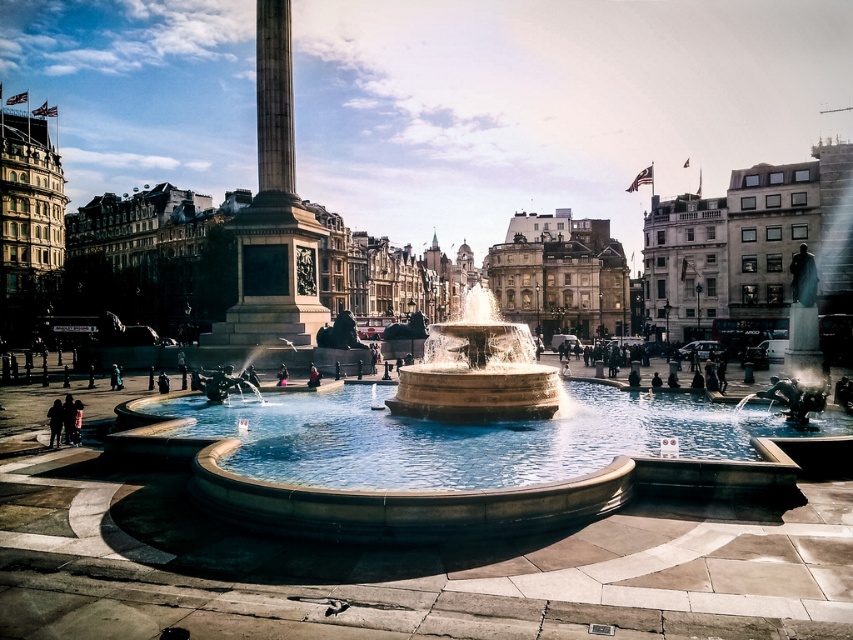
Is stone fountain at center bigger than dark fabric coat at center?

Yes, stone fountain at center is bigger than dark fabric coat at center.

Between point (389, 403) and point (279, 371), which one is positioned behind?

Point (279, 371)

Between point (473, 392) and point (279, 368), which one is positioned behind?

The point (279, 368) is behind.

Identify the location of stone fountain at center. The image size is (853, 640). (477, 371).

Which of these two, smooth stone fountain at center or dark fabric coat at center, stands shorter?

Standing shorter between the two is dark fabric coat at center.

Between smooth stone fountain at center and dark fabric coat at center, which one is positioned lower?

dark fabric coat at center is lower down.

In the scene shown: Who is more forward, (474, 451) or (287, 378)?

Point (474, 451) is more forward.

Identify the location of smooth stone fountain at center. This screenshot has height=640, width=853. (457, 454).

From the picture: Is smooth stone fountain at center above smooth stone obelisk at center?

Incorrect, smooth stone fountain at center is not positioned above smooth stone obelisk at center.

Describe the element at coordinates (457, 454) in the screenshot. This screenshot has height=640, width=853. I see `smooth stone fountain at center` at that location.

Find the location of a particular element. The height and width of the screenshot is (640, 853). smooth stone fountain at center is located at coordinates (457, 454).